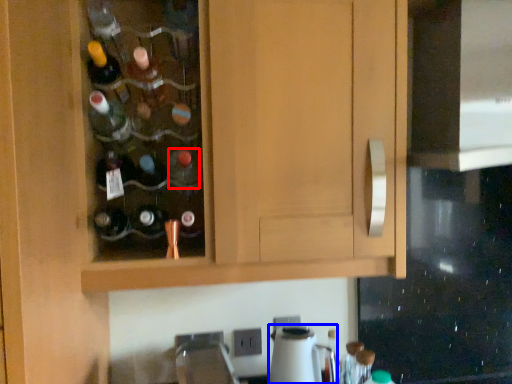
Question: Which object appears closest to the camera in this image, bottle (highlighted by a red box) or appliance (highlighted by a blue box)?

Choices:
 (A) bottle
 (B) appliance

Answer: (A)